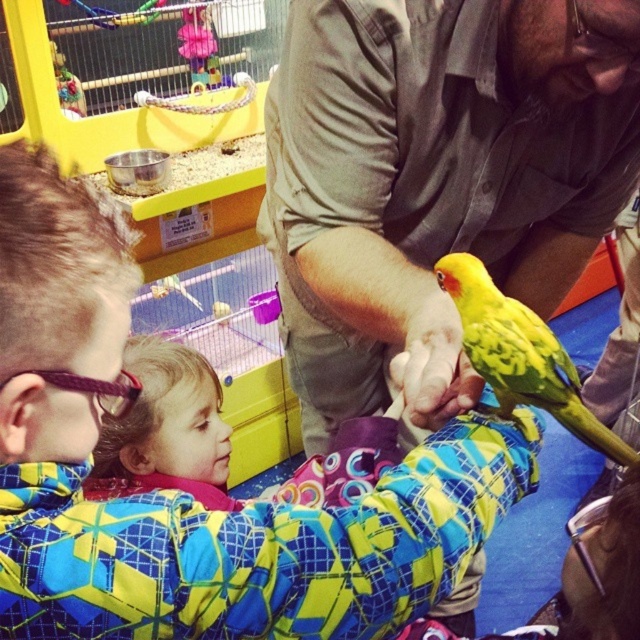
You are a photographer trying to capture a candid shot of the khaki cotton shirt at center and the plaid fleece jacket at lower left. Since you want both subjects in focus, which one should you adjust your camera focus to prioritize?

The plaid fleece jacket at lower left is behind the khaki cotton shirt at center, so you should focus on the khaki cotton shirt at center to ensure both are in focus as the jacket is further away.

You are a photographer trying to capture the scene between the plaid fleece jacket at lower left and the soft pink fabric at lower left. Which object should you focus on first if you want to start from the left side and move to the right?

The soft pink fabric at lower left should be focused on first since the plaid fleece jacket at lower left is positioned to its right side, making the soft pink fabric the leftmost object.